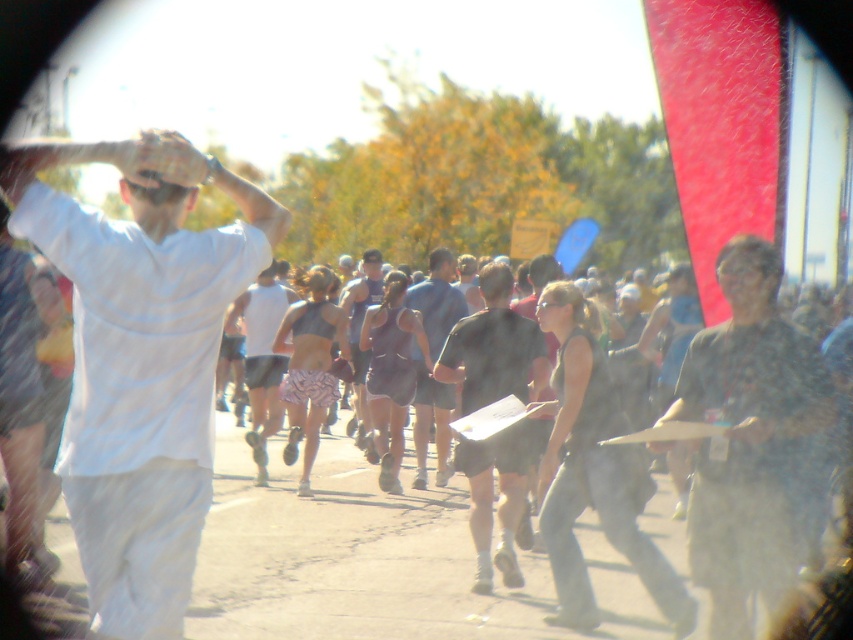
Question: Among these points, which one is farthest from the camera?

Choices:
 (A) [x=817, y=365]
 (B) [x=3, y=176]

Answer: (A)

Question: Among these points, which one is nearest to the camera?

Choices:
 (A) (372, 285)
 (B) (91, 230)

Answer: (B)

Question: Does gray asphalt pavement at center appear on the left side of dark green camouflage shirt at center?

Choices:
 (A) no
 (B) yes

Answer: (B)

Question: In this image, where is dark blue shirt at center located relative to dark gray tank top at center?

Choices:
 (A) left
 (B) right

Answer: (B)

Question: In this image, where is gray asphalt pavement at center located relative to matte gray tank top at center?

Choices:
 (A) right
 (B) left

Answer: (A)

Question: Which point is closer to the camera?

Choices:
 (A) black matte shorts at center
 (B) gray asphalt pavement at center

Answer: (B)